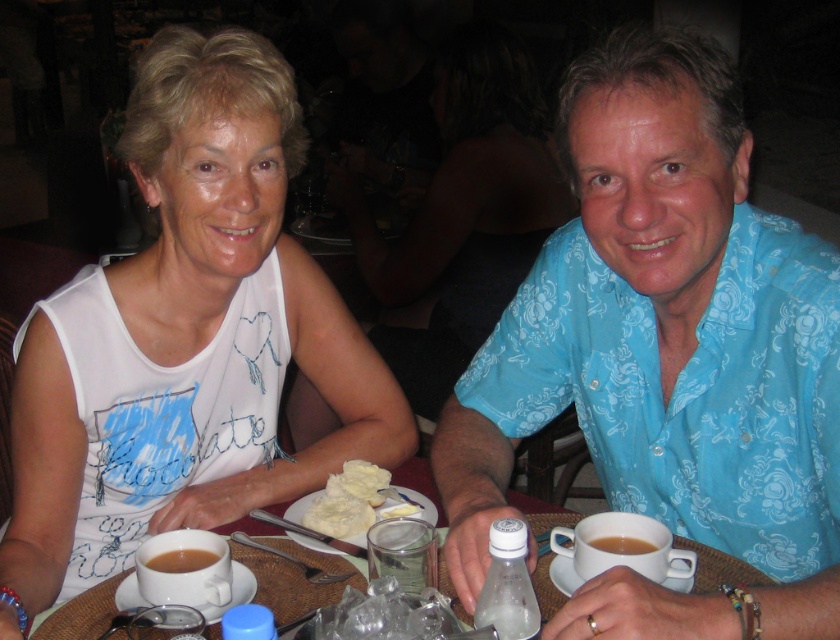
Can you confirm if blue floral shirt at center is taller than brown matte cup at lower left?

Correct, blue floral shirt at center is much taller as brown matte cup at lower left.

Is point (583, 172) positioned behind point (174, 556)?

Yes, it is.

Identify the location of blue floral shirt at center. (665, 355).

Can you confirm if white buttery bread at center is shorter than brown matte cup at lower left?

No, white buttery bread at center is not shorter than brown matte cup at lower left.

Is point (333, 518) more distant than point (176, 570)?

Yes, it is.

Which is behind, point (395, 497) or point (158, 561)?

Positioned behind is point (395, 497).

The height and width of the screenshot is (640, 840). Identify the location of white buttery bread at center. (357, 500).

Is blue floral shirt at center wider than white buttery bread at center?

Correct, the width of blue floral shirt at center exceeds that of white buttery bread at center.

Is blue floral shirt at center closer to camera compared to white buttery bread at center?

That is True.

Who is more forward, (722,269) or (316,516)?

Positioned in front is point (722,269).

This screenshot has height=640, width=840. Find the location of `blue floral shirt at center`. blue floral shirt at center is located at coordinates (665, 355).